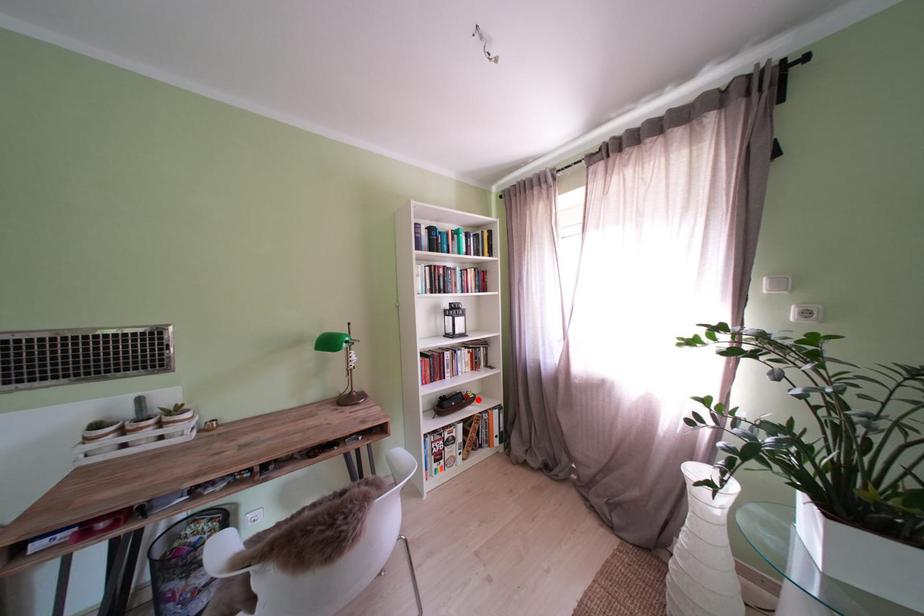
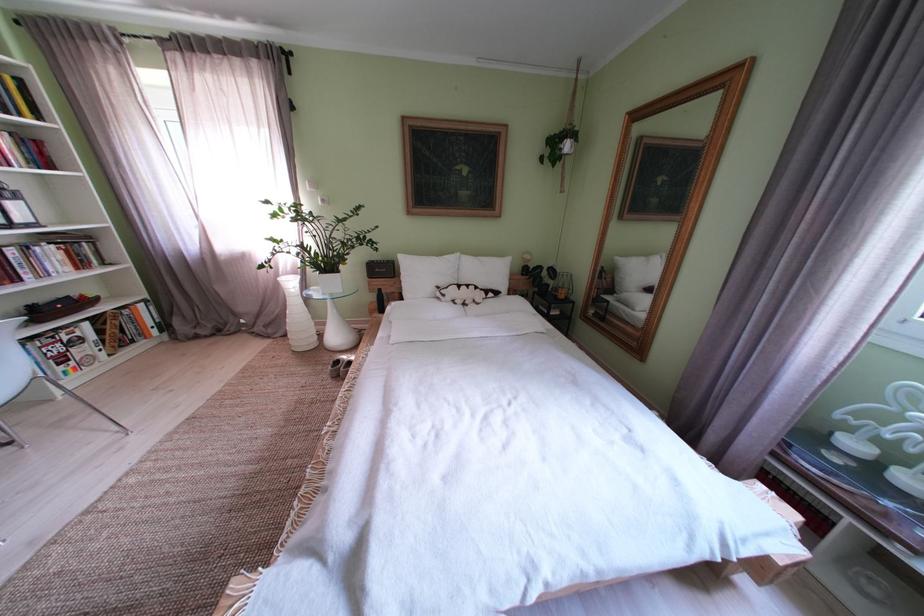
Find the pixel in the second image that matches the highlighted location in the first image.

(92, 302)